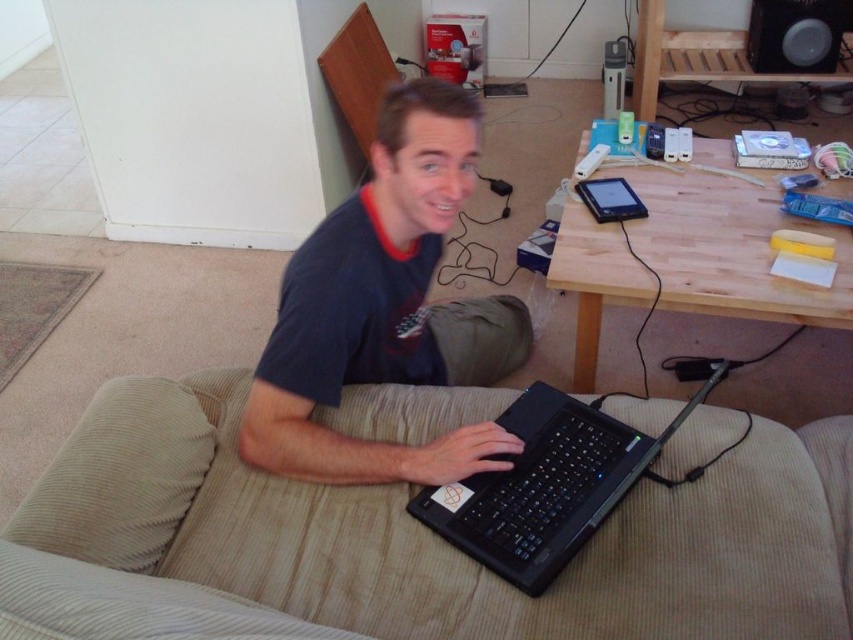
Does point (378, 227) come closer to viewer compared to point (502, 362)?

Yes, it is in front of point (502, 362).

Can you confirm if matte black laptop at center is wider than khaki fabric pants at lower center?

Yes, matte black laptop at center is wider than khaki fabric pants at lower center.

The image size is (853, 640). Find the location of `matte black laptop at center`. matte black laptop at center is located at coordinates (383, 308).

The height and width of the screenshot is (640, 853). What are the coordinates of `matte black laptop at center` in the screenshot? It's located at (383, 308).

Where is `beige corduroy couch at center`? beige corduroy couch at center is located at coordinates (403, 544).

Who is positioned more to the right, beige corduroy couch at center or black plastic speaker at upper right?

From the viewer's perspective, black plastic speaker at upper right appears more on the right side.

Which is behind, point (199, 452) or point (795, 45)?

Positioned behind is point (795, 45).

At what (x,y) coordinates should I click in order to perform the action: click on beige corduroy couch at center. Please return your answer as a coordinate pair (x, y). The image size is (853, 640). Looking at the image, I should click on (403, 544).

In the scene shown: Can you confirm if beige corduroy couch at center is shorter than black plastic laptop at center?

In fact, beige corduroy couch at center may be taller than black plastic laptop at center.

Based on the photo, who is taller, beige corduroy couch at center or black plastic laptop at center?

Standing taller between the two is beige corduroy couch at center.

Locate an element on the screen. The height and width of the screenshot is (640, 853). beige corduroy couch at center is located at coordinates (403, 544).

You are a GUI agent. You are given a task and a screenshot of the screen. Output one action in this format:
    pyautogui.click(x=<x>, y=<y>)
    Task: Click on the beige corduroy couch at center
    The height and width of the screenshot is (640, 853).
    Given the screenshot: What is the action you would take?
    pyautogui.click(x=403, y=544)